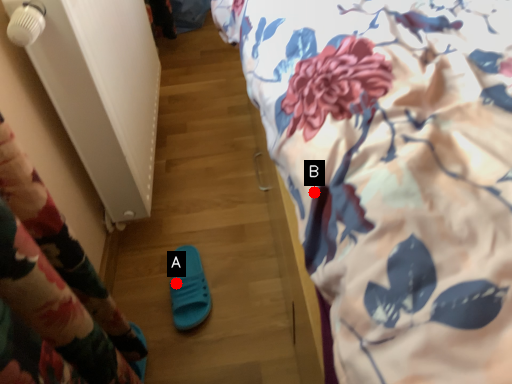
Question: Two points are circled on the image, labeled by A and B beside each circle. Which point is closer to the camera taking this photo?

Choices:
 (A) A is closer
 (B) B is closer

Answer: (B)